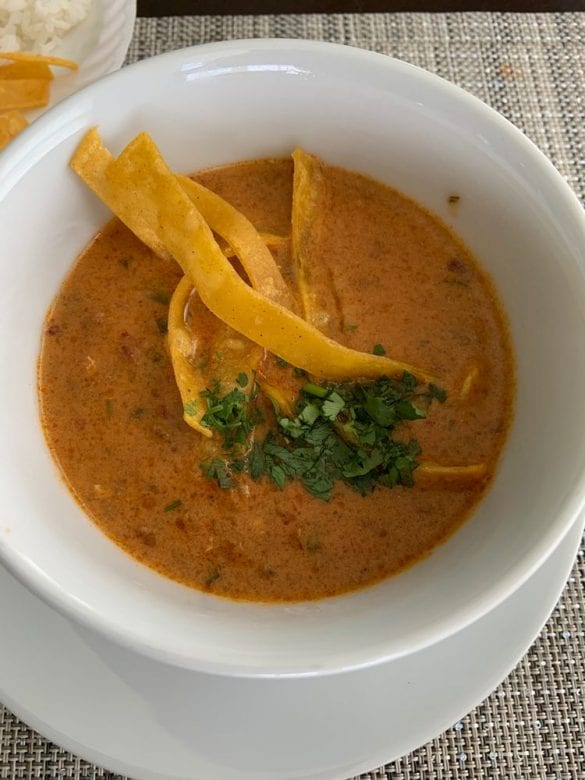
Identify the location of brown fabric. This screenshot has height=780, width=585. (536, 681).